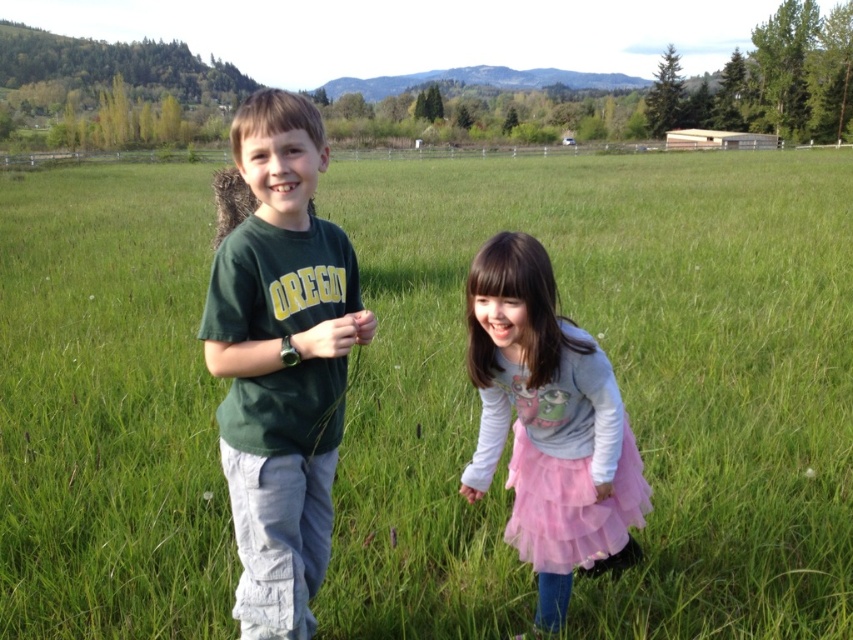
You are a photographer standing in the grassy field. You want to take a photo of the green cotton shirt at center and the pink tulle skirt at lower center. How far apart are these two items from each other?

The green cotton shirt at center is 3.51 feet away from the pink tulle skirt at lower center.

You are a photographer trying to capture a closeup of the pink tulle skirt at lower center without the pink tulle skirt at center blocking the view. Which direction should you move your camera to achieve this?

Move the camera to the right side so that the pink tulle skirt at center is no longer blocking the view of the pink tulle skirt at lower center.